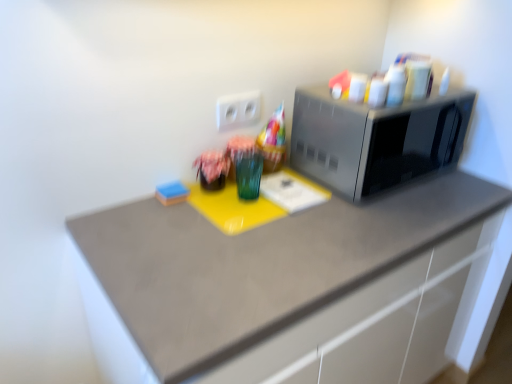
Question: Is matte gray countertop at center surrounded by satin silver microwave at right?

Choices:
 (A) no
 (B) yes

Answer: (A)

Question: From the image's perspective, is satin silver microwave at right over matte gray countertop at center?

Choices:
 (A) yes
 (B) no

Answer: (A)

Question: Is satin silver microwave at right positioned with its back to matte gray countertop at center?

Choices:
 (A) no
 (B) yes

Answer: (A)

Question: Is satin silver microwave at right touching matte gray countertop at center?

Choices:
 (A) no
 (B) yes

Answer: (A)

Question: Is satin silver microwave at right to the left of matte gray countertop at center from the viewer's perspective?

Choices:
 (A) yes
 (B) no

Answer: (B)

Question: From the image's perspective, is matte fabric flower at center located above or below satin silver microwave at right?

Choices:
 (A) below
 (B) above

Answer: (A)

Question: Is matte fabric flower at center in front of or behind satin silver microwave at right in the image?

Choices:
 (A) behind
 (B) front

Answer: (A)

Question: From a real-world perspective, is matte fabric flower at center above or below satin silver microwave at right?

Choices:
 (A) below
 (B) above

Answer: (A)

Question: Is matte fabric flower at center inside or outside of satin silver microwave at right?

Choices:
 (A) outside
 (B) inside

Answer: (A)

Question: From a real-world perspective, is green glass at center positioned above or below satin silver microwave at right?

Choices:
 (A) below
 (B) above

Answer: (A)

Question: Does point (237, 178) appear closer or farther from the camera than point (458, 148)?

Choices:
 (A) closer
 (B) farther

Answer: (A)

Question: From the image's perspective, is green glass at center above or below satin silver microwave at right?

Choices:
 (A) above
 (B) below

Answer: (B)

Question: Considering their positions, is green glass at center located in front of or behind satin silver microwave at right?

Choices:
 (A) front
 (B) behind

Answer: (B)

Question: Considering the positions of point pos(159,195) and point pos(206,168), is point pos(159,195) closer or farther from the camera than point pos(206,168)?

Choices:
 (A) farther
 (B) closer

Answer: (B)

Question: From the image's perspective, relative to matte fabric flower at center, is blue sponge at lower left above or below?

Choices:
 (A) above
 (B) below

Answer: (B)